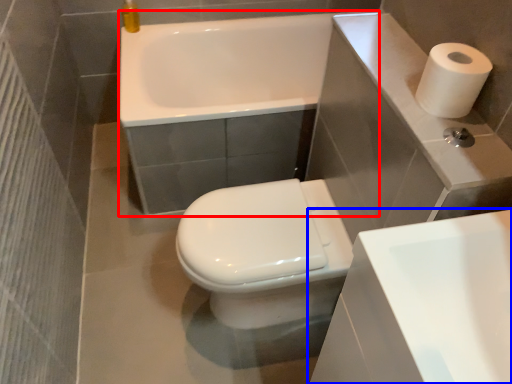
Question: Which point is closer to the camera, bath (highlighted by a red box) or sink (highlighted by a blue box)?

Choices:
 (A) bath
 (B) sink

Answer: (B)